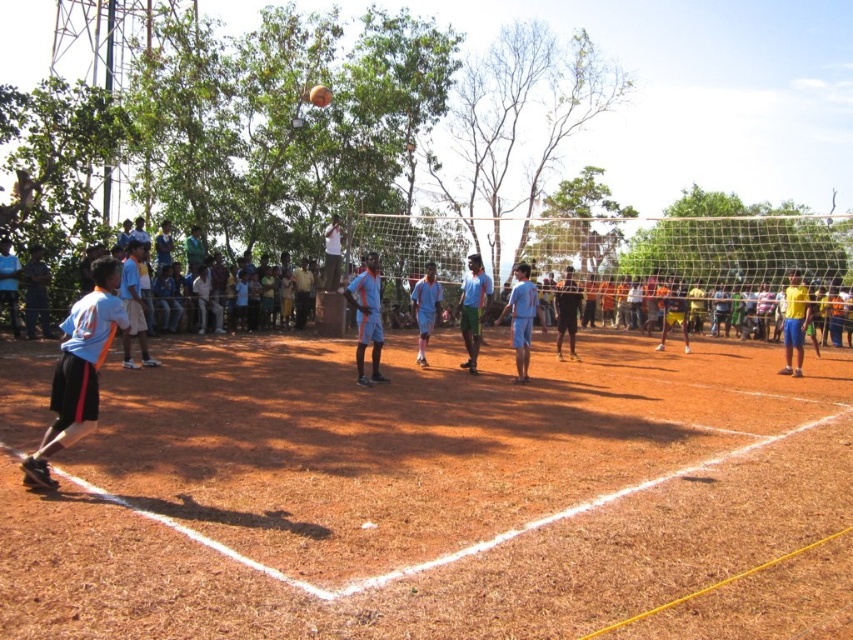
Question: Is light blue jersey at left closer to camera compared to blue jersey at center?

Choices:
 (A) yes
 (B) no

Answer: (A)

Question: Which point is farther from the camera taking this photo?

Choices:
 (A) (798, 323)
 (B) (463, 285)

Answer: (A)

Question: Is light blue jersey at left wider than yellow fabric shorts at right?

Choices:
 (A) no
 (B) yes

Answer: (B)

Question: Is brown dirt field at center bigger than yellow fabric shorts at right?

Choices:
 (A) yes
 (B) no

Answer: (A)

Question: Which object is the closest to the brown dirt field at center?

Choices:
 (A) light blue jersey at left
 (B) blue jersey at center
 (C) yellow fabric shorts at right

Answer: (A)

Question: Which is farther from the light blue jersey at left?

Choices:
 (A) blue jersey at center
 (B) brown dirt field at center

Answer: (A)